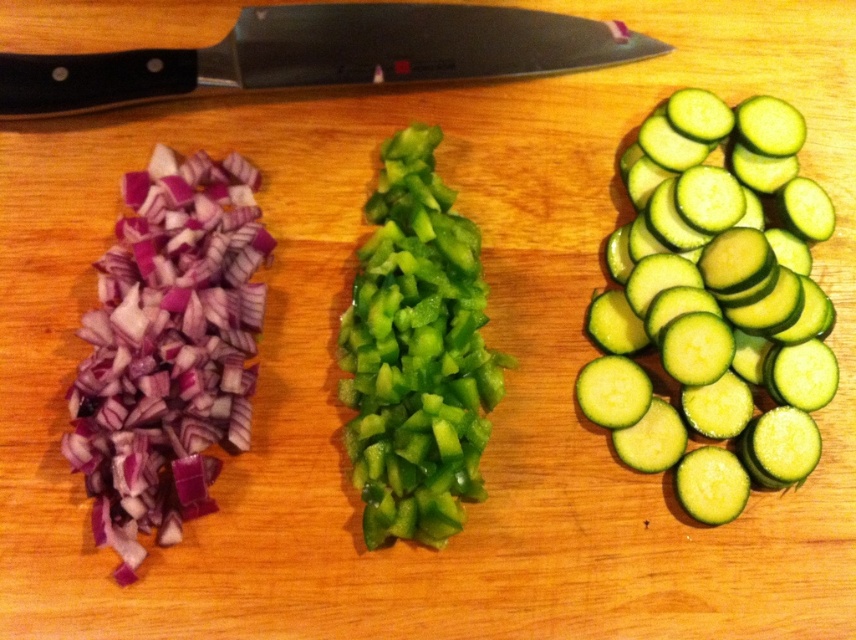
You are preparing a salad and need to arrange the vegetables in a specific order. You have the matte purple onion at left and the green glossy bell pepper at center. Which vegetable should you place first if you want to maintain their original left to right arrangement?

You should place the matte purple onion at left first because it is positioned on the left side of the green glossy bell pepper at center in the original arrangement.

You are standing in the kitchen and want to reach the point marked at coordinates (397,403) on the cutting board. Considering the distance, can you safely extend your hand to touch that spot without moving closer?

The distance between the point at (397,403) and the viewer is 3.99 feet. Since the average human arm length is about 2.5 feet, you cannot safely reach the point without moving closer.